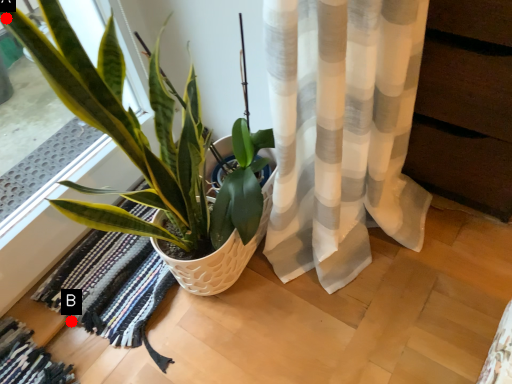
Question: Two points are circled on the image, labeled by A and B beside each circle. Which point is farther to the camera?

Choices:
 (A) A is further
 (B) B is further

Answer: (B)